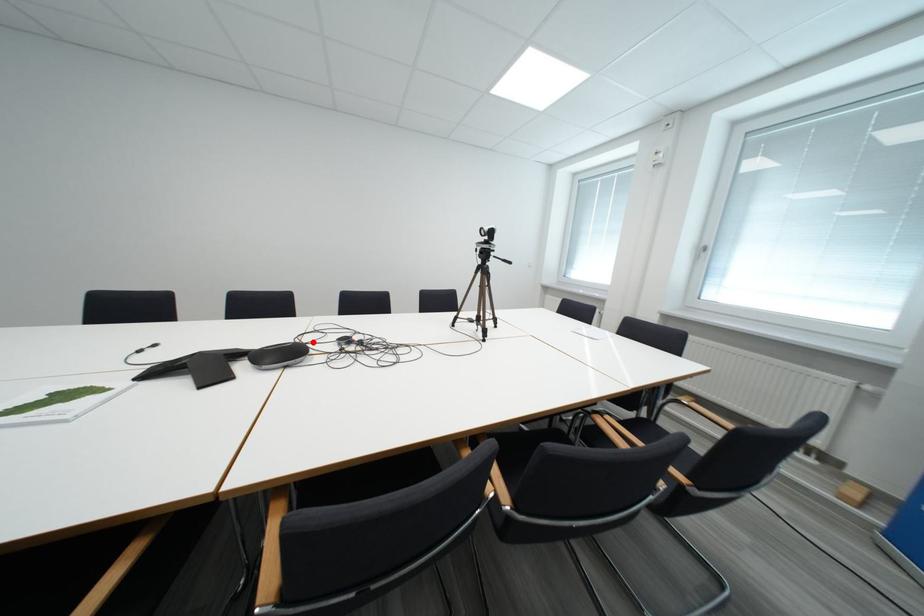
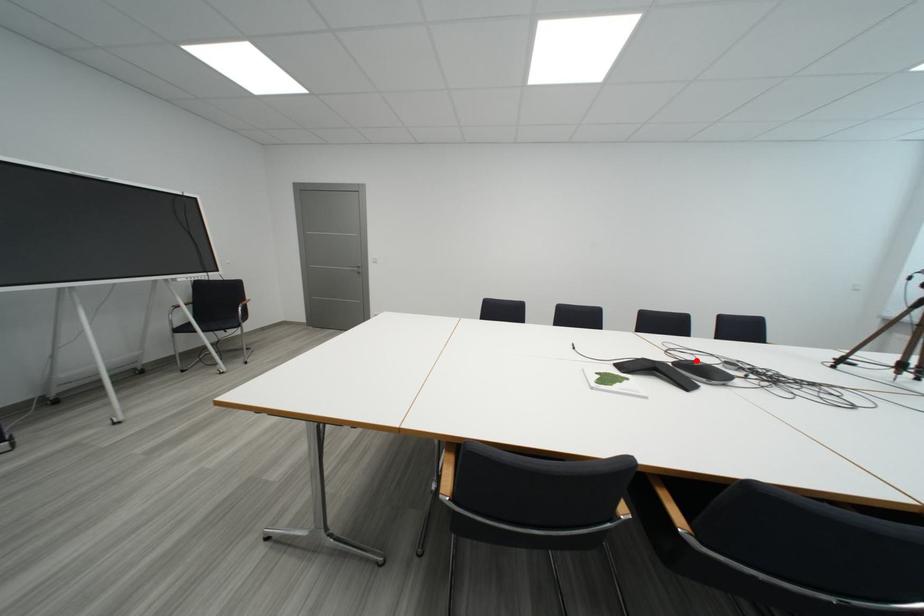
I am providing you with two images of the same scene from different viewpoints. A red point is marked on the first image and another point is marked on the second image. Are the points marked in image1 and image2 representing the same 3D position?

Yes